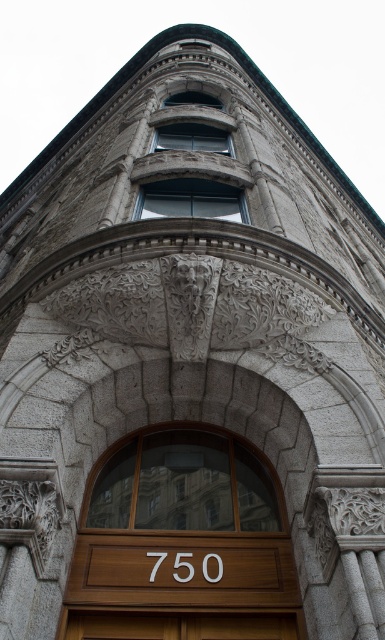
Question: Among these objects, which one is nearest to the camera?

Choices:
 (A) brown wooden door at center
 (B) wooden door at center

Answer: (B)

Question: Which object is closer to the camera taking this photo?

Choices:
 (A) brown wooden door at center
 (B) wooden door at center

Answer: (B)

Question: Is wooden door at center smaller than brown wooden door at center?

Choices:
 (A) yes
 (B) no

Answer: (B)

Question: Is wooden door at center further to camera compared to brown wooden door at center?

Choices:
 (A) yes
 (B) no

Answer: (B)

Question: Is wooden door at center behind brown wooden door at center?

Choices:
 (A) yes
 (B) no

Answer: (B)